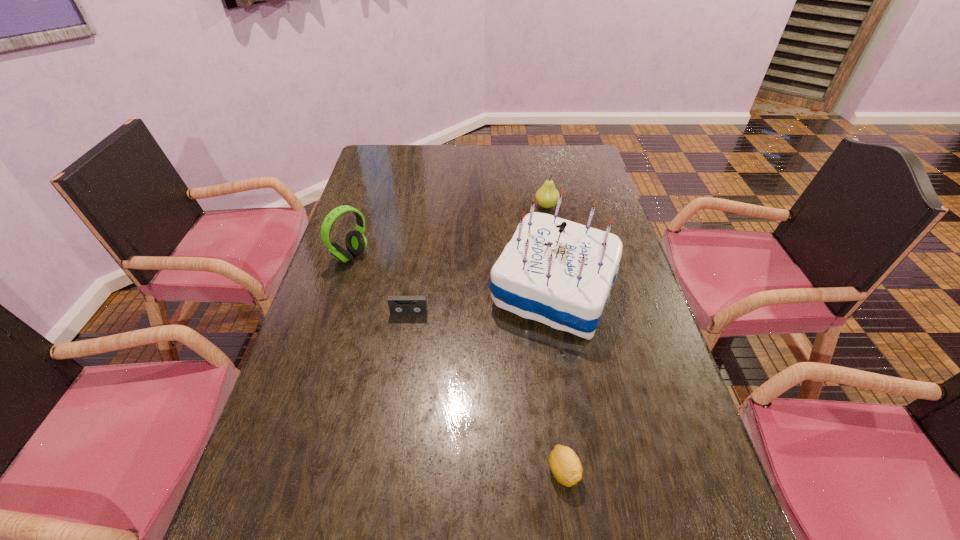
Locate an element on the screen. The width and height of the screenshot is (960, 540). vacant space located on the front-facing side of the second object from left to right is located at coordinates (396, 400).

Identify the location of free point located at the stem end of the lemon. (572, 534).

Locate an element on the screen. Image resolution: width=960 pixels, height=540 pixels. object located in the left edge section of the desktop is located at coordinates (356, 243).

This screenshot has width=960, height=540. What are the coordinates of `object positioned at the right edge` in the screenshot? It's located at (560, 273).

Locate an element on the screen. free space at the far edge of the desktop is located at coordinates (512, 154).

In the image, there is a desktop. Where is `vacant space at the left edge`? vacant space at the left edge is located at coordinates (326, 330).

You are a GUI agent. You are given a task and a screenshot of the screen. Output one action in this format:
    pyautogui.click(x=<x>, y=<y>)
    Task: Click on the blank area at the right edge
    This screenshot has height=540, width=960.
    Given the screenshot: What is the action you would take?
    pyautogui.click(x=651, y=352)

Locate an element on the screen. The width and height of the screenshot is (960, 540). vacant space at the far left corner of the desktop is located at coordinates (391, 149).

Locate an element on the screen. unoccupied position between the third tallest object and the headset is located at coordinates (448, 231).

Where is `vacant space that's between the lemon and the fifth object from right to left`? This screenshot has height=540, width=960. vacant space that's between the lemon and the fifth object from right to left is located at coordinates (487, 393).